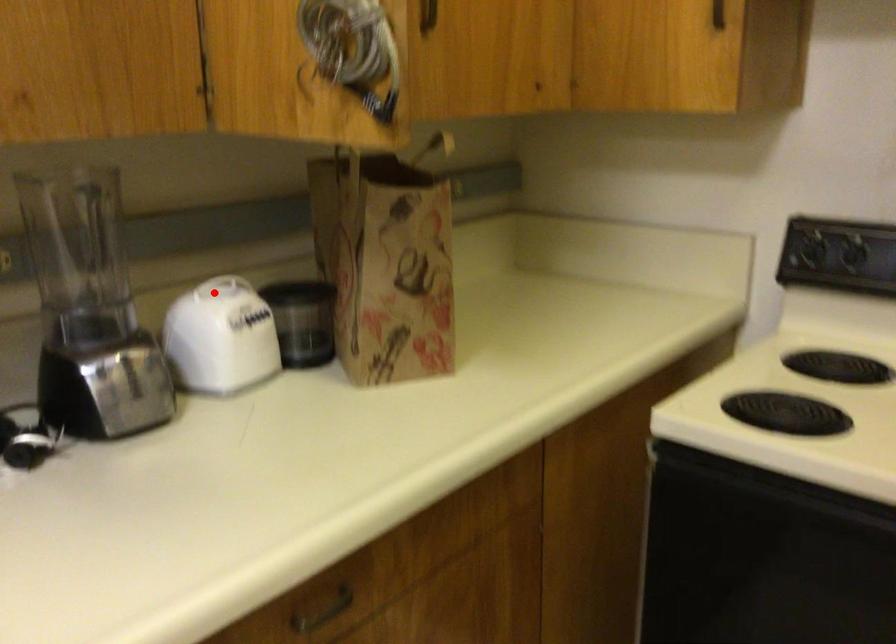
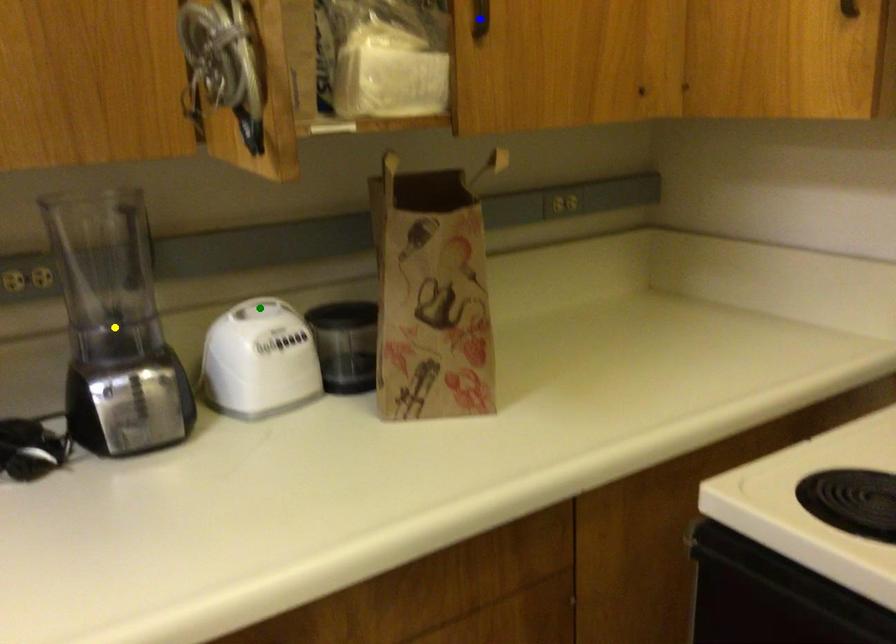
Question: I am providing you with two images of the same scene from different viewpoints. A red point is marked on the first image. You are given multiple points on the second image. Which point in image 2 represents the same 3d spot as the red point in image 1?

Choices:
 (A) blue point
 (B) green point
 (C) yellow point

Answer: (B)